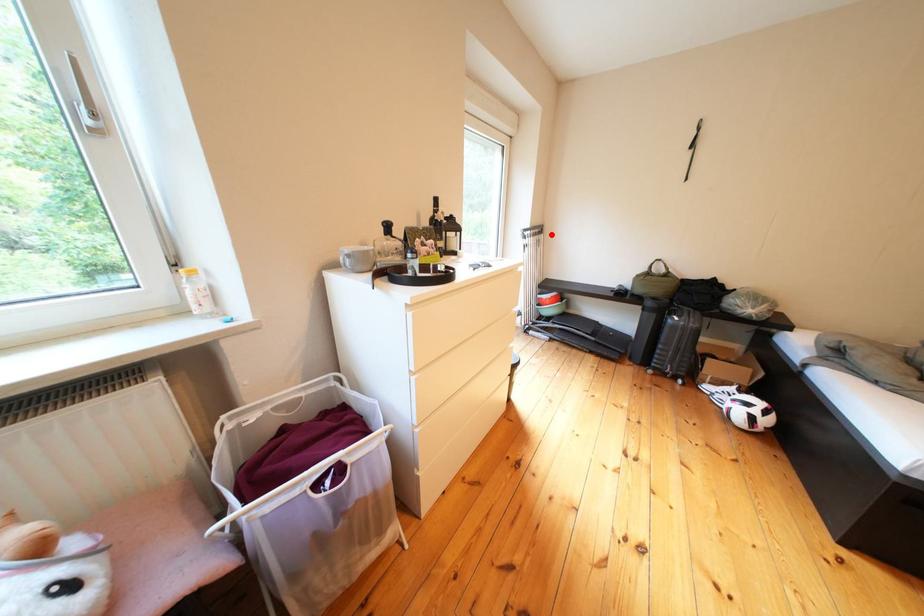
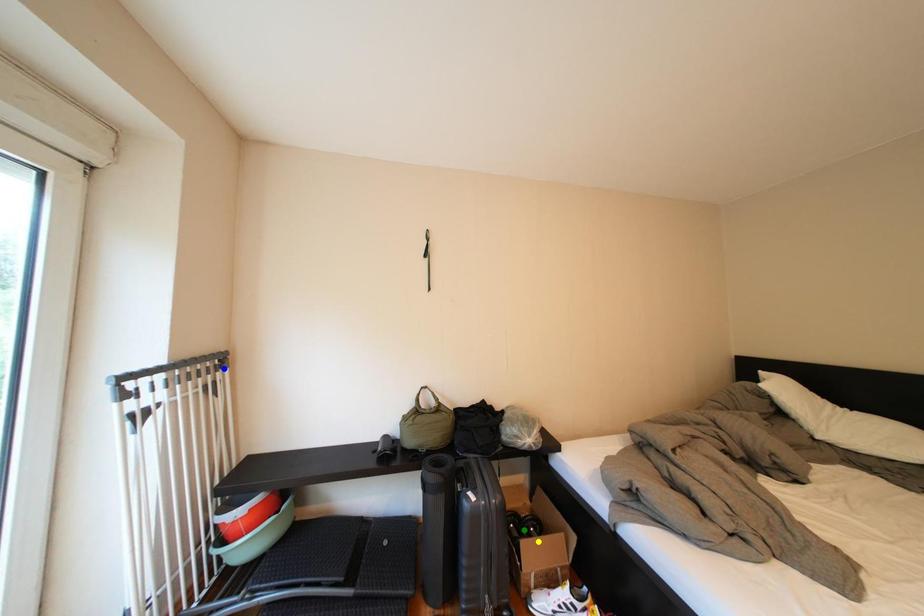
Question: I am providing you with two images of the same scene from different viewpoints. A red point is marked on the first image. You are given multiple points on the second image. Which mark in image 2 goes with the point in image 1?

Choices:
 (A) green point
 (B) blue point
 (C) yellow point

Answer: (B)